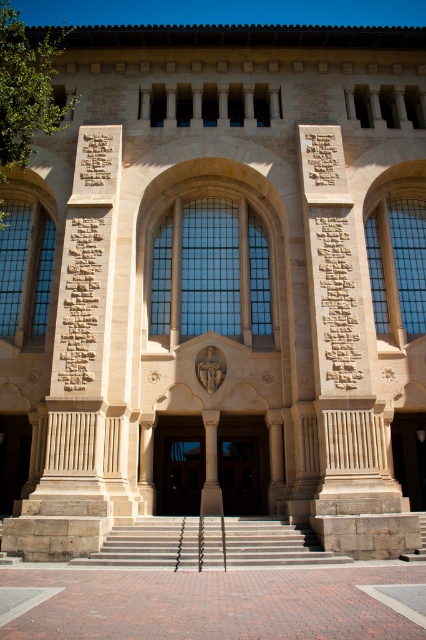
You are a visitor approaching the grand building and need to locate the entrance. You see the light gray concrete stairs at center and the carved stone inscription at center. Which object is bigger and can help you identify the main entrance?

The light gray concrete stairs at center has a larger size compared to the carved stone inscription at center, so the stairs are bigger and can help identify the main entrance.

You are standing in front of the grand building and want to read the carved stone inscription at center. Which direction should you look relative to the light gray concrete stairs at center?

You should look upward from the light gray concrete stairs at center to see the carved stone inscription at center since the stairs are below the inscription.

You are standing directly in front of the grand building. Where is the clear glass window at center located in relation to your viewpoint?

The clear glass window at center is located at the central position of the building, directly facing you since it is at the center in the 2D coordinates provided.